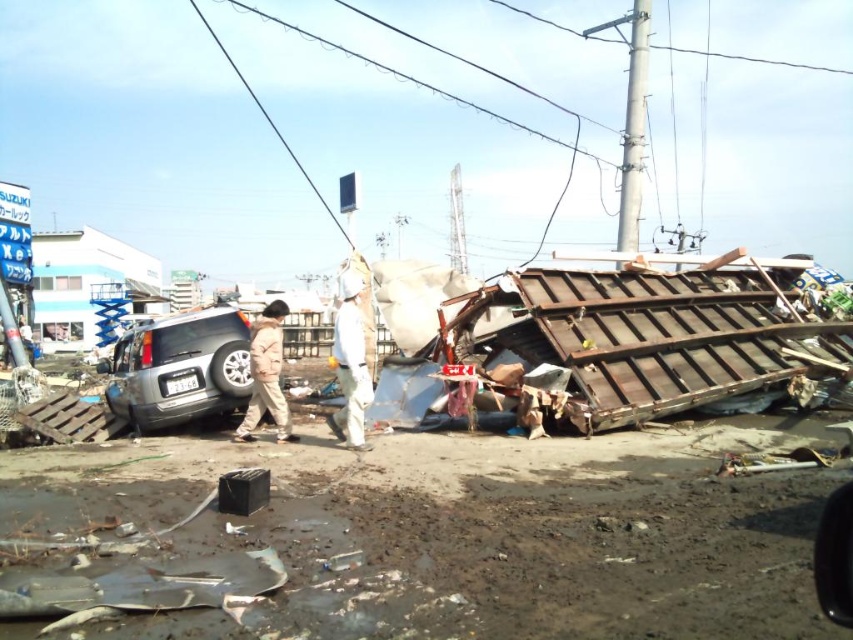
Can you confirm if silver metallic suv at center is positioned to the left of khaki fabric jacket at center?

Yes, silver metallic suv at center is to the left of khaki fabric jacket at center.

Is silver metallic suv at center to the right of khaki fabric jacket at center from the viewer's perspective?

No, silver metallic suv at center is not to the right of khaki fabric jacket at center.

Find the location of a particular element. silver metallic suv at center is located at coordinates (178, 369).

Identify the location of silver metallic suv at center. This screenshot has height=640, width=853. (178, 369).

Is white fabric at center bigger than khaki fabric jacket at center?

Yes.

Is white fabric at center shorter than khaki fabric jacket at center?

No, white fabric at center is not shorter than khaki fabric jacket at center.

Identify the location of white fabric at center. (350, 364).

Locate an element on the screen. white fabric at center is located at coordinates (350, 364).

Is silver metallic suv at center bigger than white fabric at center?

Correct, silver metallic suv at center is larger in size than white fabric at center.

Which is in front, point (161, 419) or point (358, 410)?

Positioned in front is point (358, 410).

Who is more distant from viewer, (x=224, y=324) or (x=363, y=321)?

Point (x=363, y=321)

Where is `silver metallic suv at center`? silver metallic suv at center is located at coordinates (178, 369).